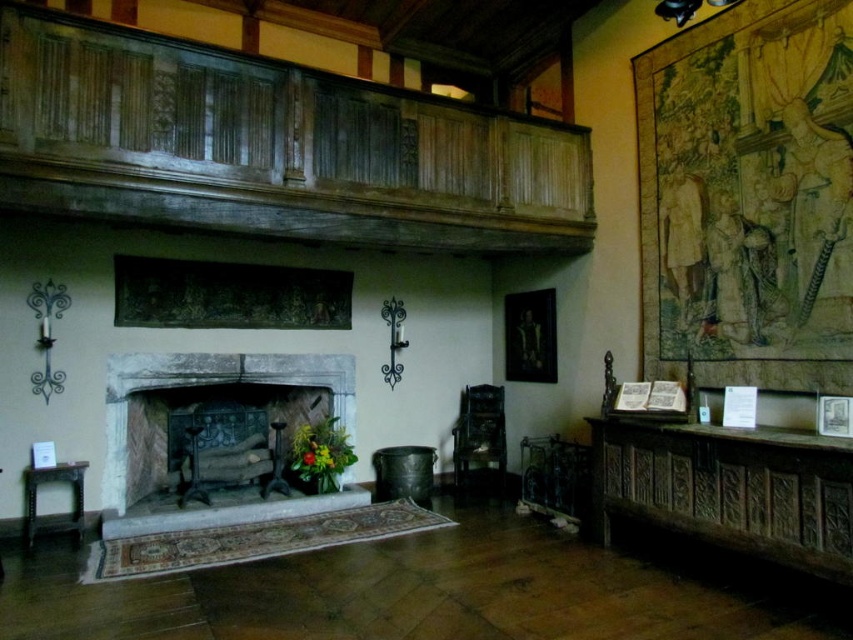
Is point (73, 144) closer to viewer compared to point (730, 465)?

No, it is not.

Image resolution: width=853 pixels, height=640 pixels. What do you see at coordinates (271, 147) in the screenshot?
I see `weathered wood mantle at upper center` at bounding box center [271, 147].

Identify the location of weathered wood mantle at upper center. The height and width of the screenshot is (640, 853). (271, 147).

Does point (122, 168) come behind point (270, 378)?

No, it is not.

Between weathered wood mantle at upper center and stone fireplace at center, which one is positioned lower?

stone fireplace at center is below.

Is point (334, 163) positioned after point (109, 490)?

No, (334, 163) is closer to viewer.

This screenshot has width=853, height=640. Find the location of `weathered wood mantle at upper center`. weathered wood mantle at upper center is located at coordinates (271, 147).

Does point (811, 556) come farther from viewer compared to point (126, 388)?

No, (811, 556) is in front of (126, 388).

Does dark wood carved chest at lower right appear on the right side of stone fireplace at center?

Yes, dark wood carved chest at lower right is to the right of stone fireplace at center.

This screenshot has width=853, height=640. What do you see at coordinates (729, 490) in the screenshot? I see `dark wood carved chest at lower right` at bounding box center [729, 490].

Where is `dark wood carved chest at lower right`? This screenshot has width=853, height=640. dark wood carved chest at lower right is located at coordinates (729, 490).